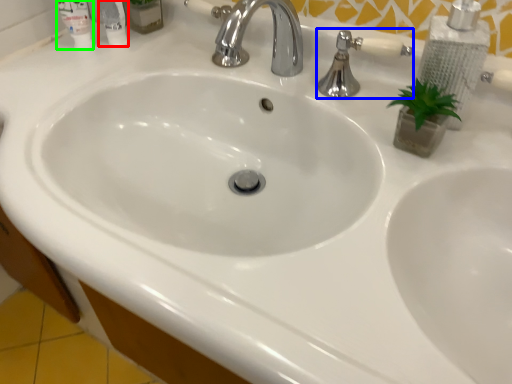
Question: Considering the real-world distances, which object is closest to mouthwash (highlighted by a red box)? plumbing fixture (highlighted by a blue box) or mouthwash (highlighted by a green box).

Choices:
 (A) plumbing fixture
 (B) mouthwash

Answer: (B)